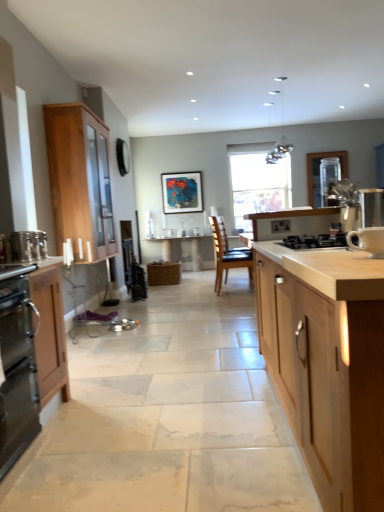
You are a GUI agent. You are given a task and a screenshot of the screen. Output one action in this format:
    pyautogui.click(x=<x>, y=<y>)
    Task: Click on the spots to the right of stainless steel oven at left, marked as the 2th cabinetry in a right-to-left arrangement
    This screenshot has height=512, width=384.
    Given the screenshot: What is the action you would take?
    pyautogui.click(x=100, y=416)